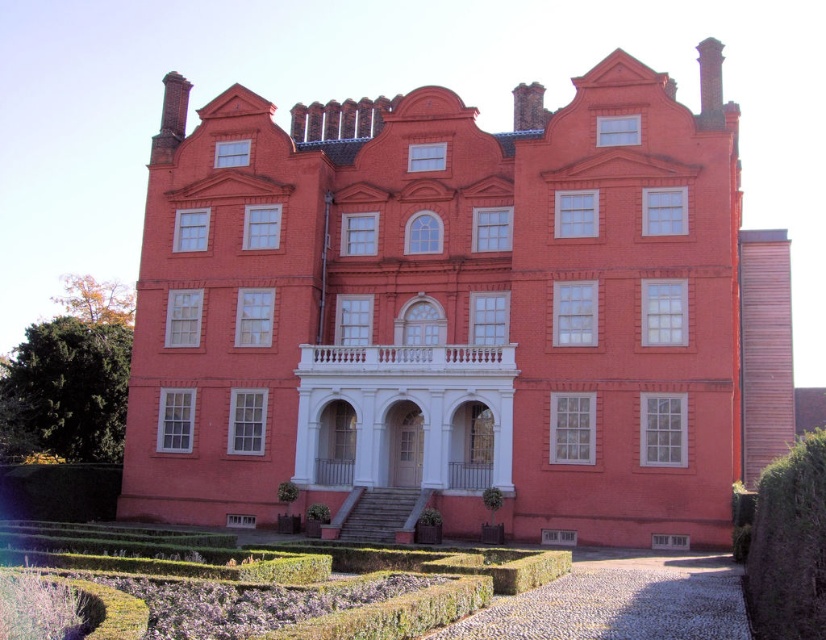
You are a gardener standing in front of the matte brick mansion at center and need to trim the dark green textured hedge at lower right. Based on their positions, which object is closer to you?

The matte brick mansion at center is closer to you since the dark green textured hedge at lower right is behind it.

You are a landscape architect designing a new pathway from the dark green textured hedge at lower right to the matte brick mansion at center. Considering their sizes, which object should you consider as the starting point for the pathway to ensure it aligns with the mansion?

The matte brick mansion at center might be wider than dark green textured hedge at lower right, so the pathway should start from the dark green textured hedge at lower right to align with the mansion.